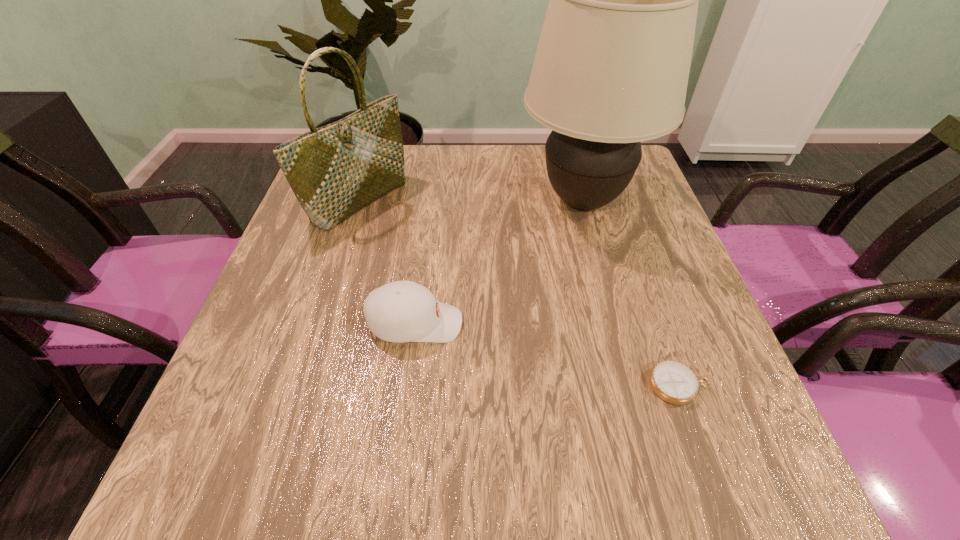
Image resolution: width=960 pixels, height=540 pixels. What are the coordinates of `empty space between the baseball cap and the compass` in the screenshot? It's located at (547, 354).

This screenshot has width=960, height=540. I want to click on empty space that is in between the nearest object and the lampshade, so click(x=632, y=293).

Identify the location of object that is the closest to the second nearest object. pyautogui.click(x=334, y=171).

This screenshot has height=540, width=960. What are the coordinates of `object that is the second closest to the nearest object` in the screenshot? It's located at [x=402, y=311].

You are a GUI agent. You are given a task and a screenshot of the screen. Output one action in this format:
    pyautogui.click(x=<x>, y=<y>)
    Task: Click on the free region that satisfies the following two spatial constraints: 1. on the front-facing side of the third tallest object; 2. on the right side of the compass
    The height and width of the screenshot is (540, 960).
    Given the screenshot: What is the action you would take?
    pyautogui.click(x=407, y=385)

Locate an element on the screen. The width and height of the screenshot is (960, 540). free region that satisfies the following two spatial constraints: 1. on the front side of the shortest object; 2. on the left side of the tallest object is located at coordinates (632, 385).

Where is `blank area in the image that satisfies the following two spatial constraints: 1. on the front-facing side of the second nearest object; 2. on the right side of the shortest object`? Image resolution: width=960 pixels, height=540 pixels. blank area in the image that satisfies the following two spatial constraints: 1. on the front-facing side of the second nearest object; 2. on the right side of the shortest object is located at coordinates (407, 385).